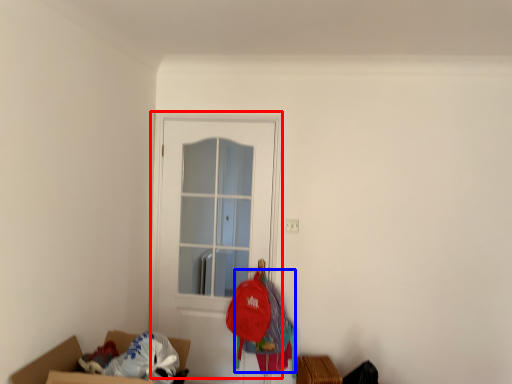
Question: Which object appears closest to the camera in this image, door (highlighted by a red box) or clothing (highlighted by a blue box)?

Choices:
 (A) door
 (B) clothing

Answer: (B)